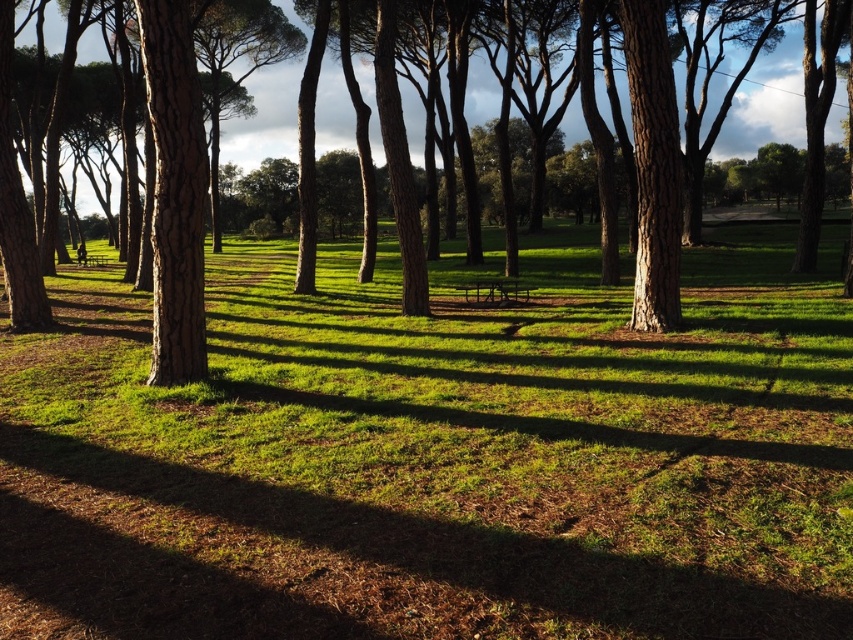
You are standing in the park and see two points marked in the image. Which point, point (796, 632) or point (734, 124), is closer to you?

Point (796, 632) is closer to you than point (734, 124).

You are standing in the park and see the green grassy at center and the brown rough tree at center. Which object is located to the right side?

The brown rough tree at center is located to the right side of the green grassy at center.